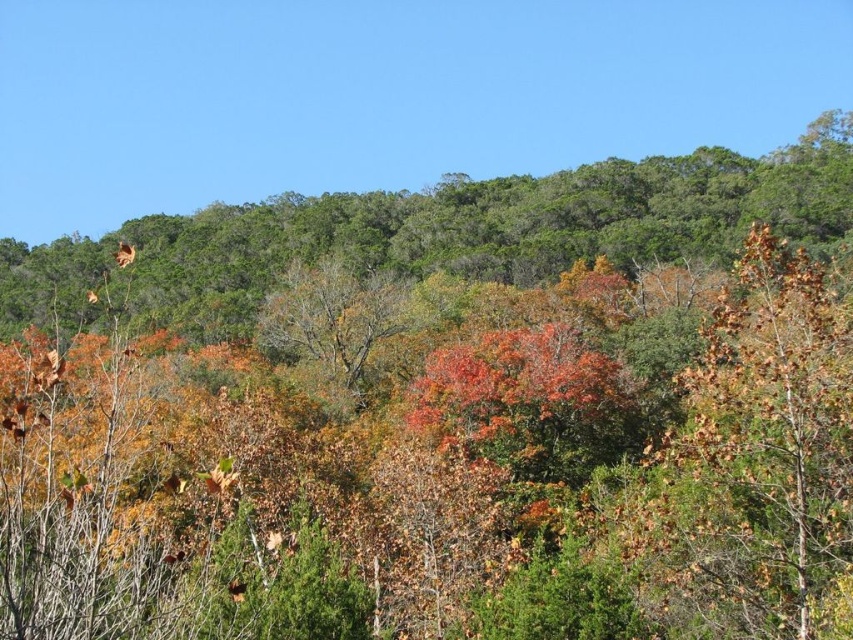
Question: Which of the following is the closest to the observer?

Choices:
 (A) brown/dried leaves at right
 (B) brown textured tree at center

Answer: (A)

Question: Which point is closer to the camera?

Choices:
 (A) brown/dried leaves at right
 (B) brown textured tree at center

Answer: (A)

Question: From the image, what is the correct spatial relationship of brown/dried leaves at right in relation to brown textured tree at center?

Choices:
 (A) above
 (B) below

Answer: (B)

Question: Which point is farther to the camera?

Choices:
 (A) brown/dried leaves at right
 (B) brown textured tree at center

Answer: (B)

Question: Can you confirm if brown/dried leaves at right is smaller than brown textured tree at center?

Choices:
 (A) yes
 (B) no

Answer: (A)

Question: Is brown/dried leaves at right to the right of brown textured tree at center from the viewer's perspective?

Choices:
 (A) yes
 (B) no

Answer: (A)